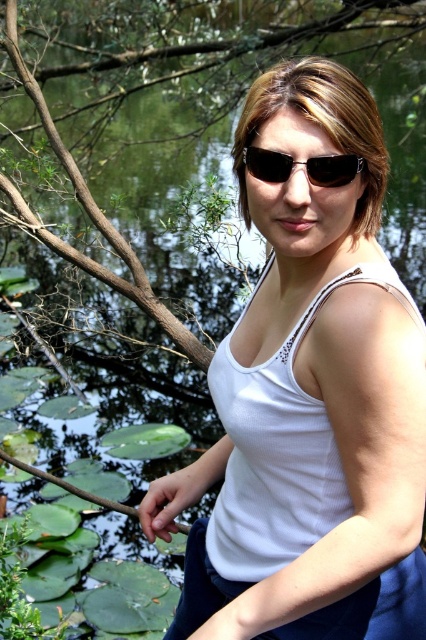
You are a photographer trying to capture the person in the scene. You want to ensure both the white matte tank top at center and the black plastic sunglasses at center are visible in your shot. Which object should you focus on first if you want to include both in the frame?

The white matte tank top at center is positioned on the left side of black plastic sunglasses at center, so focusing on the white matte tank top at center first would help ensure both objects are included in the frame.

You are a photographer trying to capture the person in the scene. Since you want to focus on the white matte tank top at center and the black plastic sunglasses at center, which one should you adjust your camera focus on first to ensure both are in sharp detail?

The white matte tank top at center is in front of the black plastic sunglasses at center, so you should focus on the white matte tank top at center first to ensure both are in sharp detail.